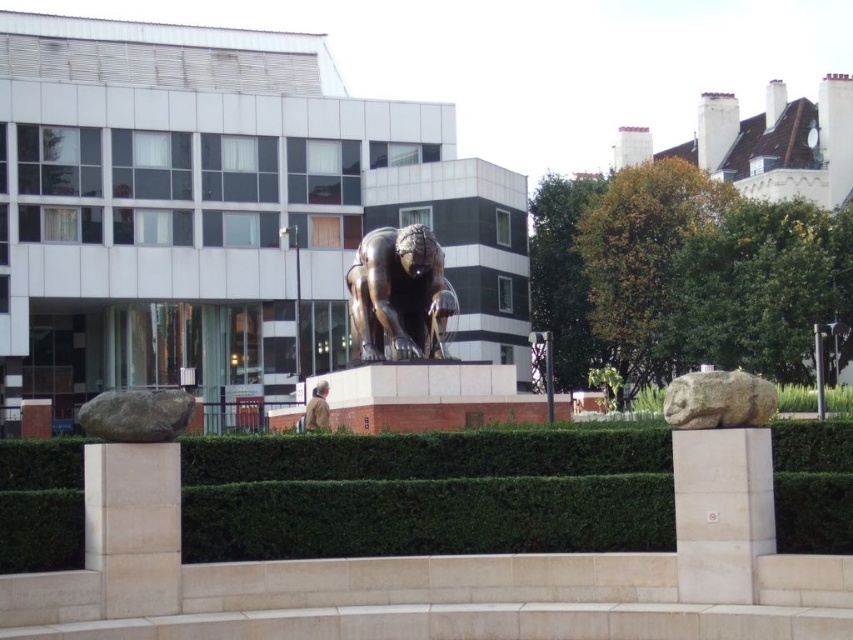
Which is behind, point (560, 200) or point (186, 412)?

The point (560, 200) is more distant.

Which is above, green leafy bush at upper right or gray rough rock at lower left?

Positioned higher is green leafy bush at upper right.

What do you see at coordinates (682, 275) in the screenshot? I see `green leafy bush at upper right` at bounding box center [682, 275].

At what (x,y) coordinates should I click in order to perform the action: click on green leafy bush at upper right. Please return your answer as a coordinate pair (x, y). Image resolution: width=853 pixels, height=640 pixels. Looking at the image, I should click on (682, 275).

Between bronze statue at center and green mossy stone at center, which one appears on the right side from the viewer's perspective?

green mossy stone at center is more to the right.

Which is behind, point (416, 339) or point (759, 412)?

The point (416, 339) is behind.

Is point (405, 332) farther from camera compared to point (701, 376)?

Yes, point (405, 332) is behind point (701, 376).

You are a GUI agent. You are given a task and a screenshot of the screen. Output one action in this format:
    pyautogui.click(x=<x>, y=<y>)
    Task: Click on the bronze statue at center
    The image size is (853, 640).
    Given the screenshot: What is the action you would take?
    pyautogui.click(x=399, y=294)

Does bronze statue at center have a greater height compared to gray rough rock at lower left?

Yes.

The image size is (853, 640). I want to click on bronze statue at center, so click(399, 294).

The height and width of the screenshot is (640, 853). What do you see at coordinates (399, 294) in the screenshot?
I see `bronze statue at center` at bounding box center [399, 294].

Find the location of a particular element. The image size is (853, 640). bronze statue at center is located at coordinates (399, 294).